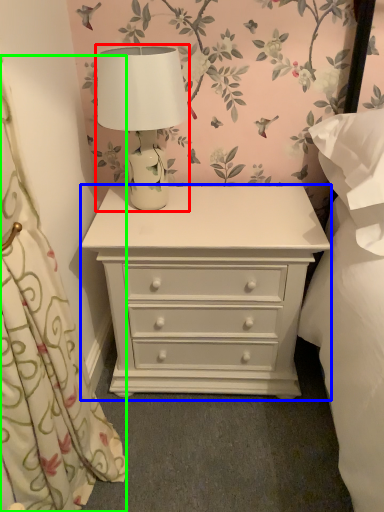
Question: Based on their relative distances, which object is farther from table lamp (highlighted by a red box)? Choose from chest of drawers (highlighted by a blue box) and curtain (highlighted by a green box).

Choices:
 (A) chest of drawers
 (B) curtain

Answer: (B)